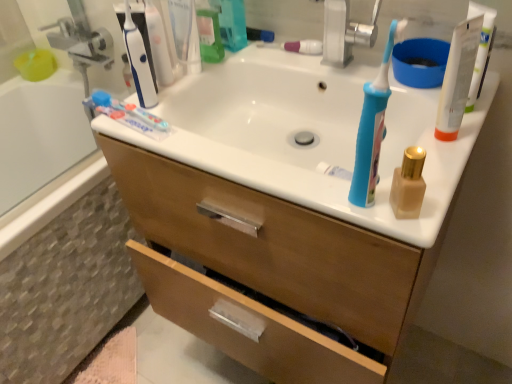
You are a GUI agent. You are given a task and a screenshot of the screen. Output one action in this format:
    pyautogui.click(x=<x>, y=<y>)
    Task: Click on the free spot to the left of silver metallic faucet at upper center
    This screenshot has height=384, width=512.
    Given the screenshot: What is the action you would take?
    pyautogui.click(x=269, y=61)